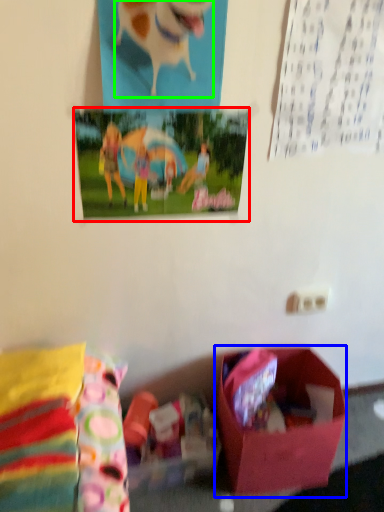
Question: Based on their relative distances, which object is farther from postcard (highlighted by a red box)? Choose from box (highlighted by a blue box) and animal (highlighted by a green box).

Choices:
 (A) box
 (B) animal

Answer: (A)